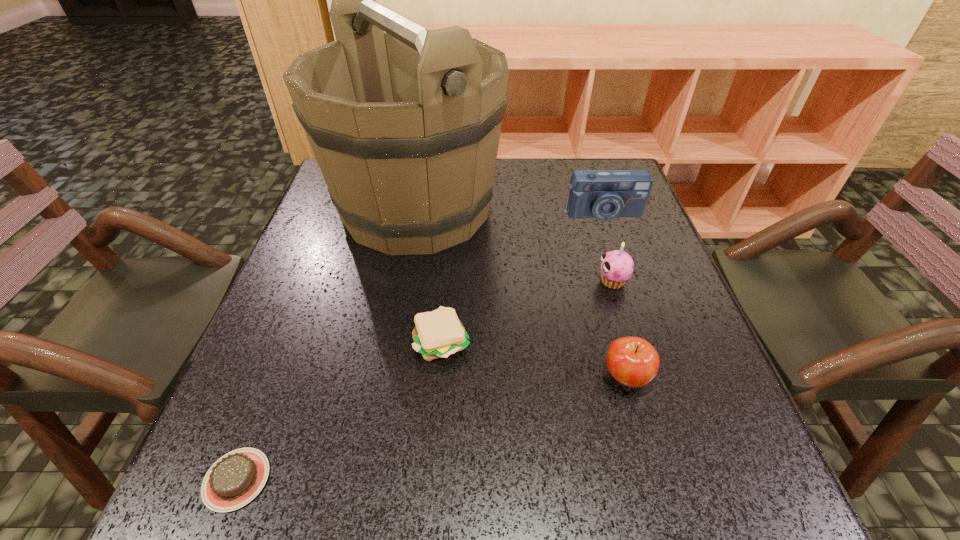
The image size is (960, 540). Find the location of `cupcake located at the right edge`. cupcake located at the right edge is located at coordinates (617, 266).

Image resolution: width=960 pixels, height=540 pixels. In order to click on apple that is at the right edge in this screenshot , I will do `click(632, 361)`.

This screenshot has height=540, width=960. I want to click on object at the far left corner, so click(404, 122).

I want to click on object that is positioned at the near left corner, so click(x=235, y=479).

Locate an element on the screen. The width and height of the screenshot is (960, 540). vacant position at the near edge of the desktop is located at coordinates (635, 520).

Where is `free space at the left edge`? Image resolution: width=960 pixels, height=540 pixels. free space at the left edge is located at coordinates (294, 254).

Identify the location of vacant space at the right edge of the desktop. (599, 222).

Find the location of a particular element. Image resolution: width=960 pixels, height=540 pixels. free space at the near right corner of the desktop is located at coordinates (725, 497).

The image size is (960, 540). I want to click on free space between the tallest object and the chocolate cake, so click(326, 344).

Find the location of a particular element. This screenshot has height=540, width=960. empty space that is in between the fourth nearest object and the third shortest object is located at coordinates (619, 329).